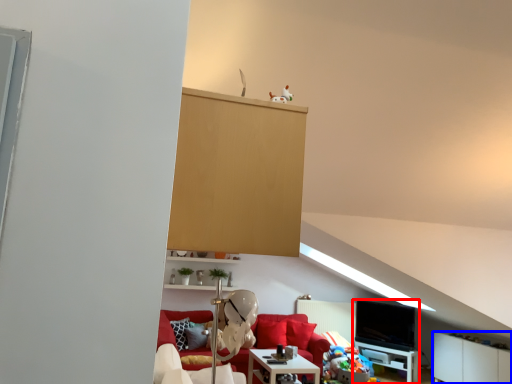
Question: Which point is further to the camera, entertainment center (highlighted by a red box) or cabinetry (highlighted by a blue box)?

Choices:
 (A) entertainment center
 (B) cabinetry

Answer: (A)